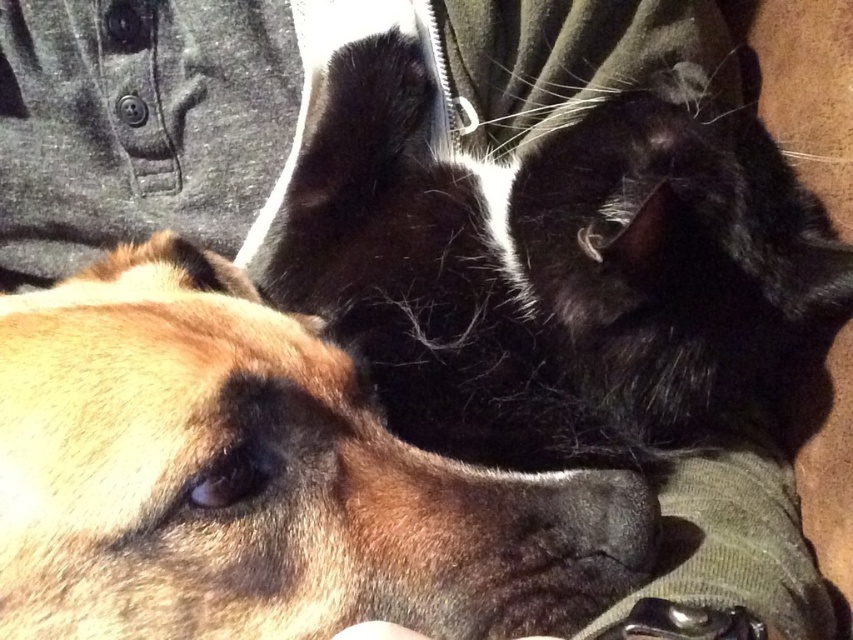
Question: Is black silky fur cat at center thinner than matte black nose at center?

Choices:
 (A) no
 (B) yes

Answer: (A)

Question: Does brown fur dog at center appear on the left side of matte black nose at center?

Choices:
 (A) yes
 (B) no

Answer: (B)

Question: Does brown fur dog at center have a smaller size compared to black silky fur cat at center?

Choices:
 (A) no
 (B) yes

Answer: (B)

Question: Which of the following is the closest to the observer?

Choices:
 (A) brown fur dog at center
 (B) black silky fur cat at center

Answer: (A)

Question: Among these points, which one is nearest to the camera?

Choices:
 (A) (236, 436)
 (B) (566, 289)
 (C) (189, 70)

Answer: (A)

Question: Which of the following is the closest to the observer?

Choices:
 (A) (204, 36)
 (B) (384, 342)
 (C) (518, 499)

Answer: (C)